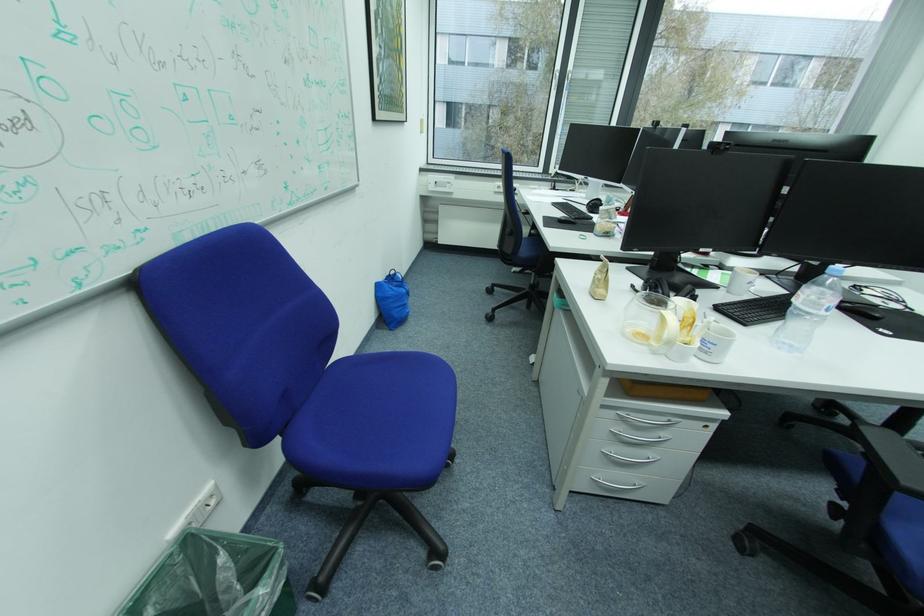
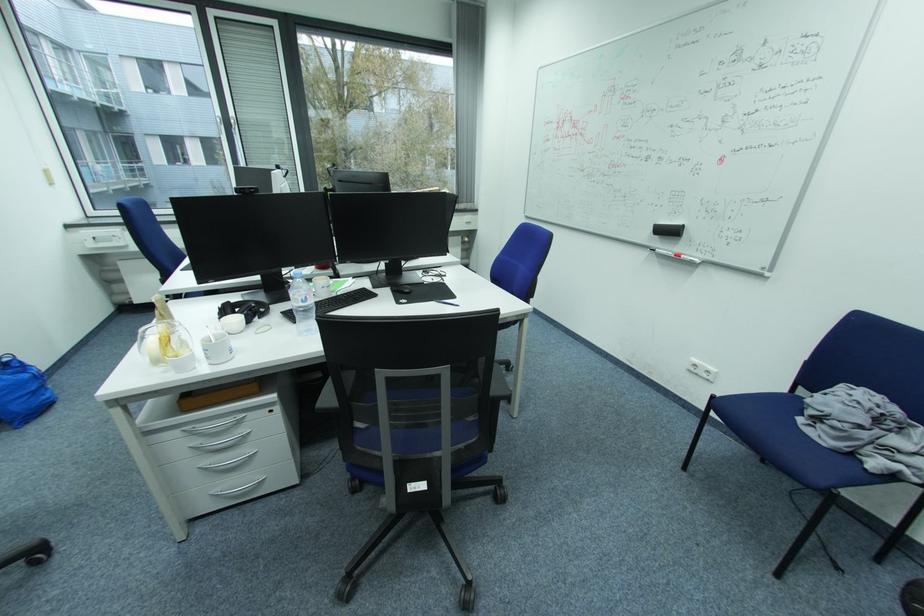
In the second image, find the point that corresponds to point (833, 308) in the first image.

(310, 301)